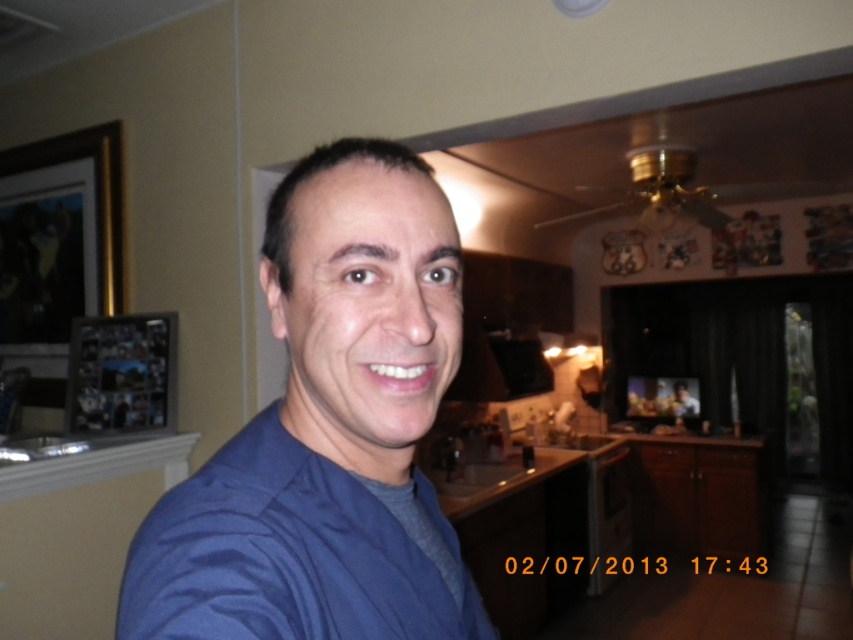
Question: Which point is closer to the camera?

Choices:
 (A) (366, 582)
 (B) (170, 371)
 (C) (422, 608)

Answer: (A)

Question: Estimate the real-world distances between objects in this image. Which object is farther from the blue smooth shirt at center?

Choices:
 (A) blue fabric shirt at center
 (B) wooden photo frame at left

Answer: (B)

Question: Does blue fabric shirt at center appear over blue smooth shirt at center?

Choices:
 (A) yes
 (B) no

Answer: (A)

Question: Does blue fabric shirt at center have a smaller size compared to blue smooth shirt at center?

Choices:
 (A) yes
 (B) no

Answer: (B)

Question: Among these points, which one is nearest to the camera?

Choices:
 (A) (369, 612)
 (B) (152, 392)
 (C) (350, 541)

Answer: (A)

Question: Considering the relative positions of blue fabric shirt at center and blue smooth shirt at center in the image provided, where is blue fabric shirt at center located with respect to blue smooth shirt at center?

Choices:
 (A) above
 (B) below

Answer: (A)